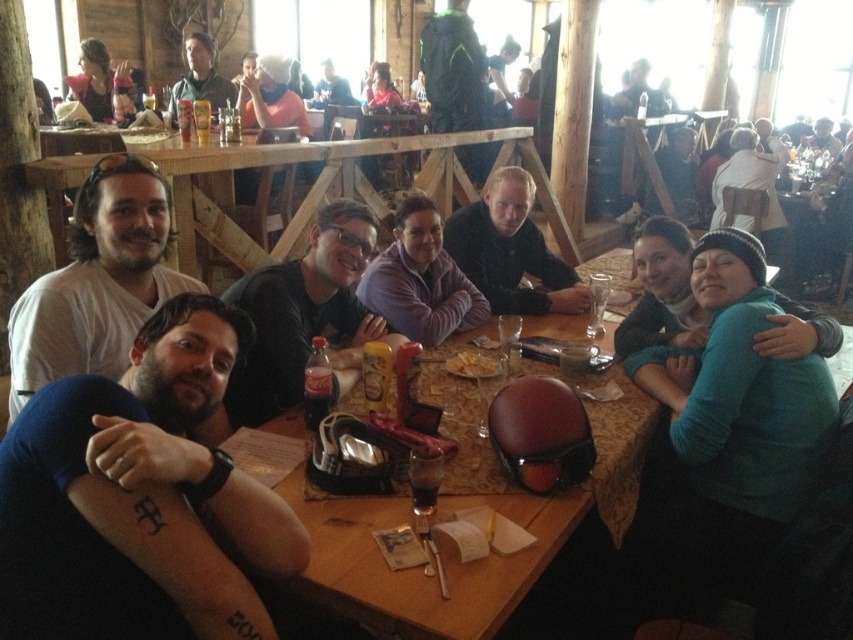
Is dark brown leather jacket at center further to the viewer compared to purple sweater at center?

That is True.

Who is taller, dark brown leather jacket at center or purple sweater at center?

Standing taller between the two is dark brown leather jacket at center.

Who is more distant from viewer, (483, 269) or (432, 273)?

Positioned behind is point (483, 269).

The width and height of the screenshot is (853, 640). Find the location of `dark brown leather jacket at center`. dark brown leather jacket at center is located at coordinates (511, 250).

The width and height of the screenshot is (853, 640). What do you see at coordinates (270, 97) in the screenshot?
I see `white knit hat at upper center` at bounding box center [270, 97].

Between point (285, 65) and point (811, 136), which one is positioned behind?

Positioned behind is point (811, 136).

Is point (286, 77) less distant than point (833, 140)?

Yes, it is in front of point (833, 140).

The image size is (853, 640). What are the coordinates of `white knit hat at upper center` in the screenshot? It's located at (270, 97).

Between point (425, 346) and point (225, 97), which one is positioned behind?

The point (225, 97) is more distant.

At what (x,y) coordinates should I click in order to perform the action: click on purple sweater at center. Please return your answer as a coordinate pair (x, y). Looking at the image, I should click on (421, 280).

You are a GUI agent. You are given a task and a screenshot of the screen. Output one action in this format:
    pyautogui.click(x=<x>, y=<y>)
    Task: Click on the purple sweater at center
    
    Given the screenshot: What is the action you would take?
    pyautogui.click(x=421, y=280)